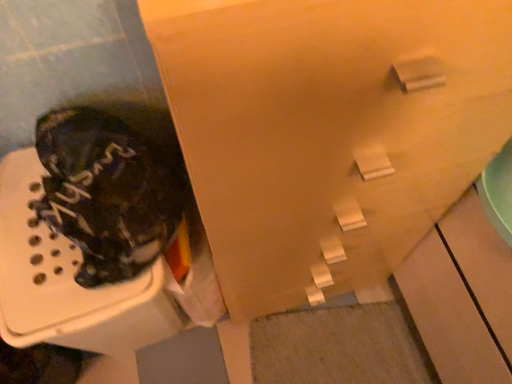
Question: Considering the positions of point (70, 119) and point (452, 96), is point (70, 119) closer or farther from the camera than point (452, 96)?

Choices:
 (A) closer
 (B) farther

Answer: (B)

Question: Looking at their shapes, would you say camouflage fabric boot at left is wider or thinner than matte wood cabinet at upper center?

Choices:
 (A) thin
 (B) wide

Answer: (A)

Question: From the image's perspective, relative to matte wood cabinet at upper center, is camouflage fabric boot at left above or below?

Choices:
 (A) below
 (B) above

Answer: (A)

Question: Considering the positions of matte wood cabinet at upper center and camouflage fabric boot at left in the image, is matte wood cabinet at upper center taller or shorter than camouflage fabric boot at left?

Choices:
 (A) tall
 (B) short

Answer: (A)

Question: Is matte wood cabinet at upper center in front of or behind camouflage fabric boot at left in the image?

Choices:
 (A) behind
 (B) front

Answer: (B)

Question: From the image's perspective, is matte wood cabinet at upper center above or below camouflage fabric boot at left?

Choices:
 (A) above
 (B) below

Answer: (A)

Question: Is point (332, 195) positioned closer to the camera than point (138, 244)?

Choices:
 (A) closer
 (B) farther

Answer: (A)